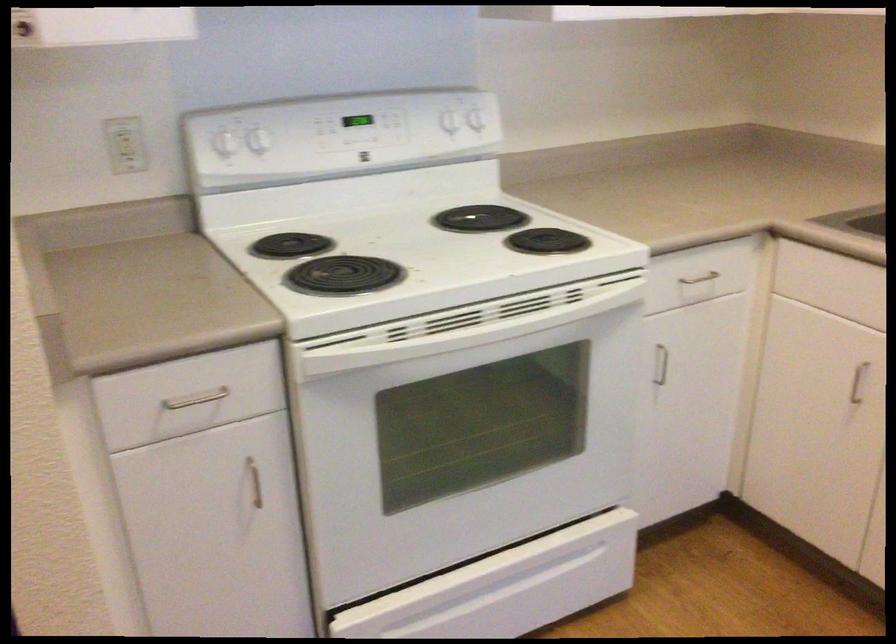
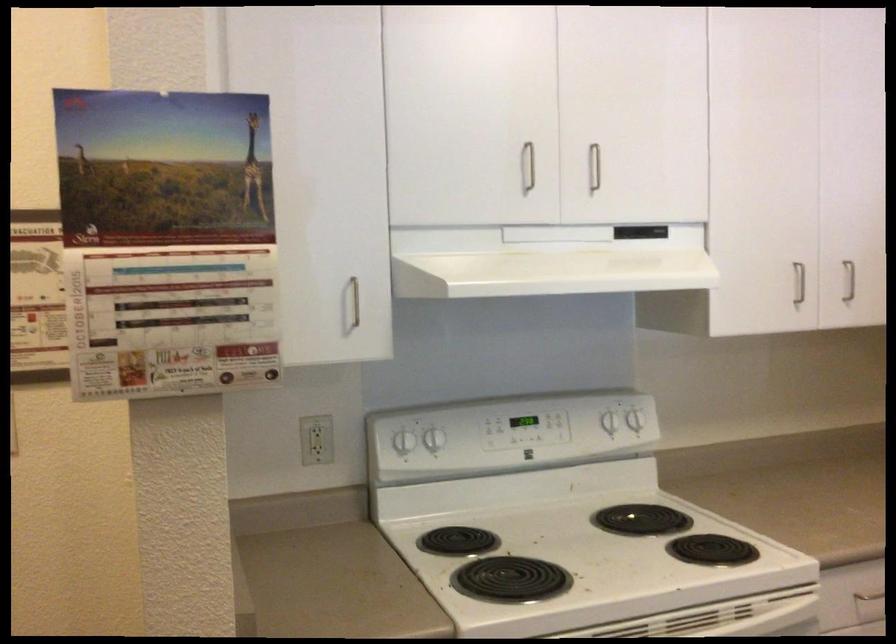
In the second image, find the point that corresponds to the point at 263,138 in the first image.

(435, 439)